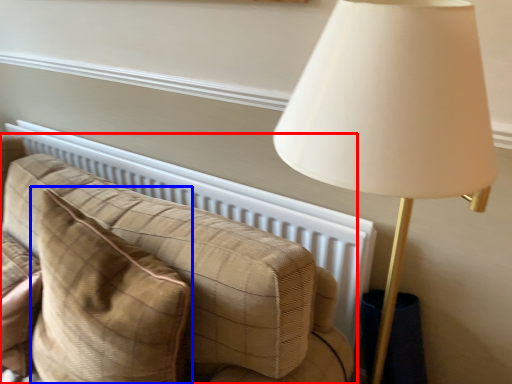
Question: Which object is further to the camera taking this photo, studio couch (highlighted by a red box) or throw pillow (highlighted by a blue box)?

Choices:
 (A) studio couch
 (B) throw pillow

Answer: (A)